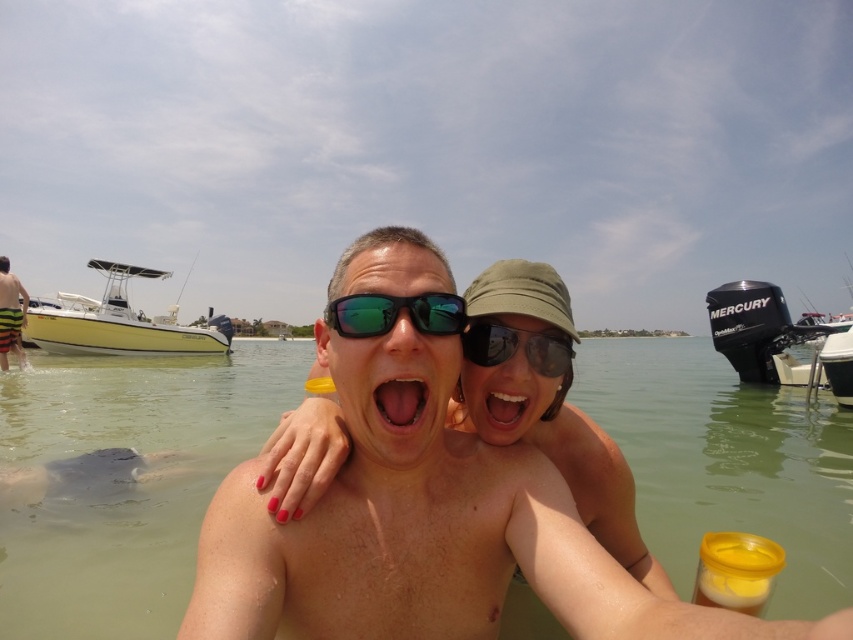
You are trying to decide which item to grab first from the beach scene. The shiny black sunglasses at center and the yellow striped shorts at left are both in your line of sight. Which item has a smaller width?

The shiny black sunglasses at center has a smaller width than the yellow striped shorts at left, as it is thinner.

You are a photographer trying to capture both the shiny black sunglasses at center and the yellow striped shorts at left in a single frame. Based on their sizes in the image, which object should you focus on first to ensure both are in the frame?

The shiny black sunglasses at center occupies less space than yellow striped shorts at left, so you should focus on the yellow striped shorts at left first to ensure both are in the frame.

You are a photographer trying to capture both the black metallic motorboat at right and the pink glossy tongue at center in a single frame. Which object should you adjust your camera angle to prioritize if you want to focus on the wider subject?

The black metallic motorboat at right is wider than the pink glossy tongue at center, so you should prioritize focusing on the black metallic motorboat at right to ensure it fits properly in the frame.